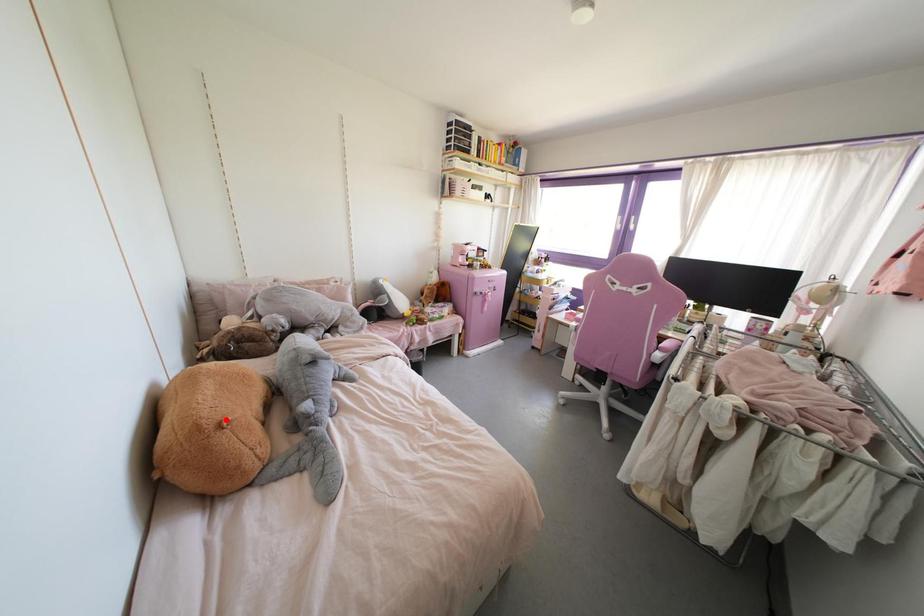
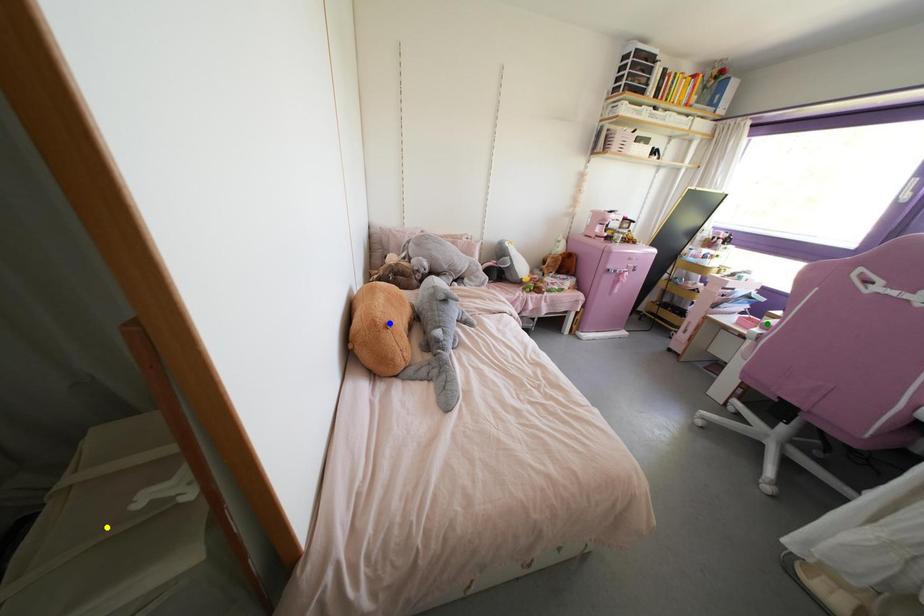
Question: I am providing you with two images of the same scene from different viewpoints. A red point is marked on the first image. You are given multiple points on the second image. Which point in image 2 is actually the same real-world point as the red point in image 1?

Choices:
 (A) yellow point
 (B) green point
 (C) blue point

Answer: (C)